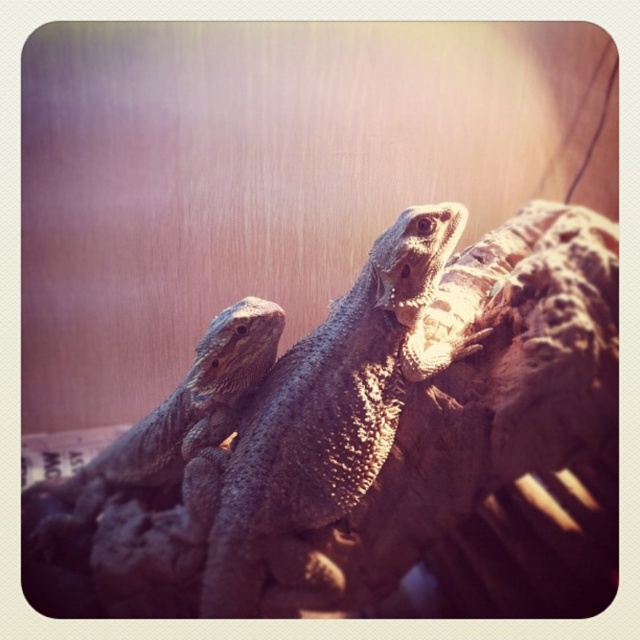
Looking at this image, does sandy brown scaly lizard at center have a greater width compared to sandy brown scaly lizard at left?

Correct, the width of sandy brown scaly lizard at center exceeds that of sandy brown scaly lizard at left.

Is sandy brown scaly lizard at center shorter than sandy brown scaly lizard at left?

Incorrect, sandy brown scaly lizard at center's height does not fall short of sandy brown scaly lizard at left's.

This screenshot has height=640, width=640. What do you see at coordinates (332, 406) in the screenshot?
I see `sandy brown scaly lizard at center` at bounding box center [332, 406].

This screenshot has width=640, height=640. I want to click on sandy brown scaly lizard at center, so click(x=332, y=406).